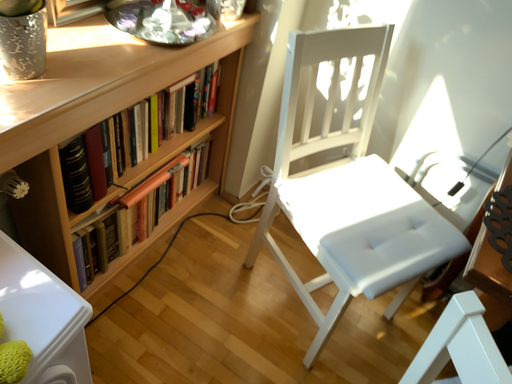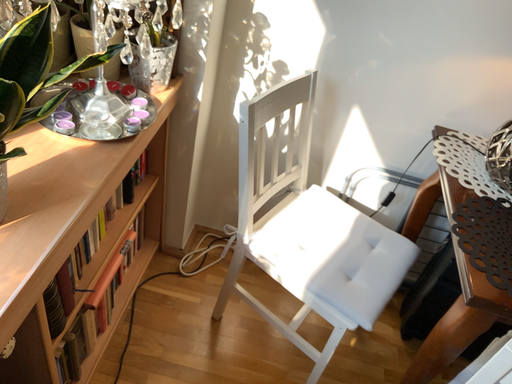
Question: How did the camera likely rotate when shooting the video?

Choices:
 (A) rotated right
 (B) rotated left

Answer: (A)